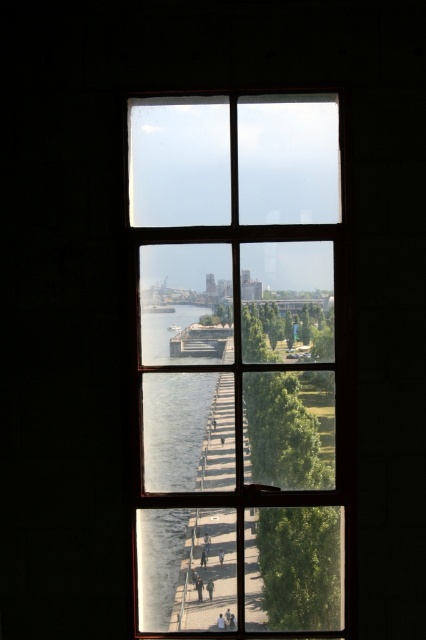
Measure the distance from wooden window at center to clear glass waterway at center.

A distance of 8.17 inches exists between wooden window at center and clear glass waterway at center.

Is wooden window at center smaller than clear glass waterway at center?

No, wooden window at center is not smaller than clear glass waterway at center.

Between point (273, 516) and point (170, 381), which one is positioned behind?

Point (170, 381)

Locate an element on the screen. The width and height of the screenshot is (426, 640). wooden window at center is located at coordinates (238, 364).